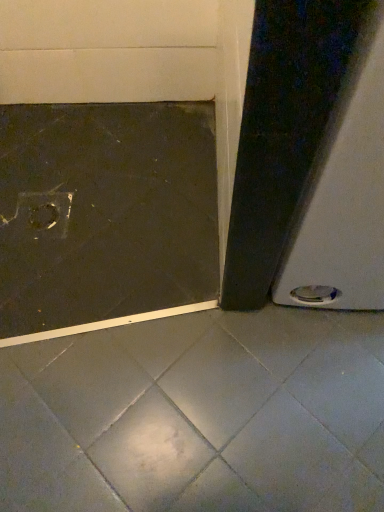
Question: Does white glossy screen door at right have a greater height compared to dark matte concrete at lower left?

Choices:
 (A) yes
 (B) no

Answer: (A)

Question: Is white glossy screen door at right facing towards dark matte concrete at lower left?

Choices:
 (A) yes
 (B) no

Answer: (B)

Question: From a real-world perspective, is white glossy screen door at right on dark matte concrete at lower left?

Choices:
 (A) no
 (B) yes

Answer: (B)

Question: Does white glossy screen door at right have a lesser width compared to dark matte concrete at lower left?

Choices:
 (A) no
 (B) yes

Answer: (B)

Question: Is white glossy screen door at right turned away from dark matte concrete at lower left?

Choices:
 (A) yes
 (B) no

Answer: (B)

Question: Is white glossy screen door at right smaller than dark matte concrete at lower left?

Choices:
 (A) yes
 (B) no

Answer: (B)

Question: Can you confirm if dark matte concrete at lower left is smaller than white glossy screen door at right?

Choices:
 (A) yes
 (B) no

Answer: (A)

Question: Does dark matte concrete at lower left come behind white glossy screen door at right?

Choices:
 (A) yes
 (B) no

Answer: (A)

Question: Considering the relative positions of dark matte concrete at lower left and white glossy screen door at right in the image provided, is dark matte concrete at lower left to the left of white glossy screen door at right from the viewer's perspective?

Choices:
 (A) yes
 (B) no

Answer: (A)

Question: From a real-world perspective, is dark matte concrete at lower left beneath white glossy screen door at right?

Choices:
 (A) no
 (B) yes

Answer: (B)

Question: Is dark matte concrete at lower left surrounding white glossy screen door at right?

Choices:
 (A) no
 (B) yes

Answer: (A)

Question: Is white glossy screen door at right at the back of dark matte concrete at lower left?

Choices:
 (A) no
 (B) yes

Answer: (A)

Question: Would you say dark matte concrete at lower left is to the left or to the right of white glossy screen door at right in the picture?

Choices:
 (A) left
 (B) right

Answer: (A)